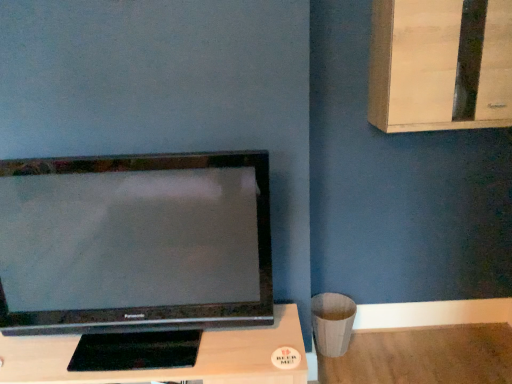
Question: Looking at their shapes, would you say black matte tv at center is wider or thinner than satin black television at left?

Choices:
 (A) wide
 (B) thin

Answer: (A)

Question: Is black matte tv at center to the left or to the right of satin black television at left in the image?

Choices:
 (A) left
 (B) right

Answer: (B)

Question: Estimate the real-world distances between objects in this image. Which object is farther from the black matte tv at center?

Choices:
 (A) satin black television at left
 (B) light wood dresser at upper right

Answer: (B)

Question: Based on their relative distances, which object is farther from the satin black television at left?

Choices:
 (A) light wood dresser at upper right
 (B) black matte tv at center

Answer: (A)